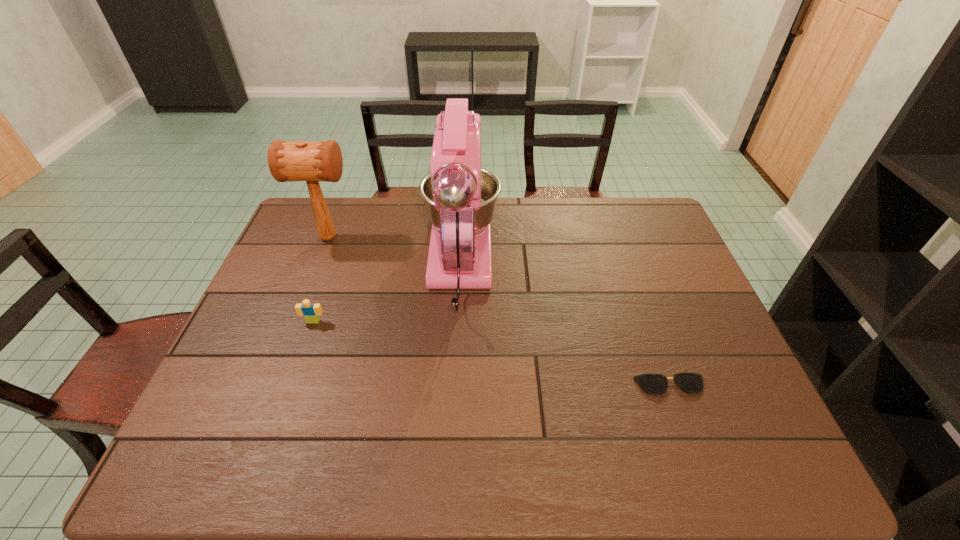
Where is `vacant area that lies between the Lego and the spectacles`? vacant area that lies between the Lego and the spectacles is located at coordinates (492, 353).

What are the coordinates of `unoccupied position between the second tallest object and the spectacles` in the screenshot? It's located at (500, 312).

Find the location of a particular element. This screenshot has width=960, height=540. object that is the nearest to the second shortest object is located at coordinates (460, 197).

Select which object is the second closest to the second tallest object. Please provide its 2D coordinates. Your answer should be formatted as a tuple, i.e. [(x, y)], where the tuple contains the x and y coordinates of a point satisfying the conditions above.

[(311, 312)]

You are a GUI agent. You are given a task and a screenshot of the screen. Output one action in this format:
    pyautogui.click(x=<x>, y=<y>)
    Task: Click on the free spot that satisfies the following two spatial constraints: 1. on the strike surface of the second tallest object; 2. on the face of the third object from left to right
    Image resolution: width=960 pixels, height=540 pixels.
    Given the screenshot: What is the action you would take?
    pyautogui.click(x=319, y=266)

Where is `vacant space that satisfies the following two spatial constraints: 1. on the face of the mixer; 2. on the strike surface of the mallet`? Image resolution: width=960 pixels, height=540 pixels. vacant space that satisfies the following two spatial constraints: 1. on the face of the mixer; 2. on the strike surface of the mallet is located at coordinates (462, 238).

Where is `free point that satisfies the following two spatial constraints: 1. on the face of the third tallest object; 2. on the right side of the rightmost object`? This screenshot has width=960, height=540. free point that satisfies the following two spatial constraints: 1. on the face of the third tallest object; 2. on the right side of the rightmost object is located at coordinates (291, 386).

This screenshot has width=960, height=540. Identify the location of vacant area in the image that satisfies the following two spatial constraints: 1. on the strike surface of the mallet; 2. on the face of the tallest object. (319, 266).

This screenshot has width=960, height=540. What are the coordinates of `free spot that satisfies the following two spatial constraints: 1. on the strike surface of the third shortest object; 2. on the face of the third object from left to right` in the screenshot? It's located at (319, 266).

This screenshot has height=540, width=960. I want to click on vacant space that satisfies the following two spatial constraints: 1. on the strike surface of the mallet; 2. on the face of the third object from left to right, so click(319, 266).